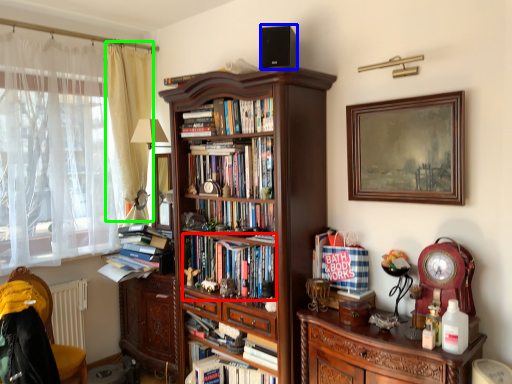
Question: Which is nearer to the book (highlighted by a red box)? speaker (highlighted by a blue box) or curtain (highlighted by a green box).

Choices:
 (A) speaker
 (B) curtain

Answer: (B)